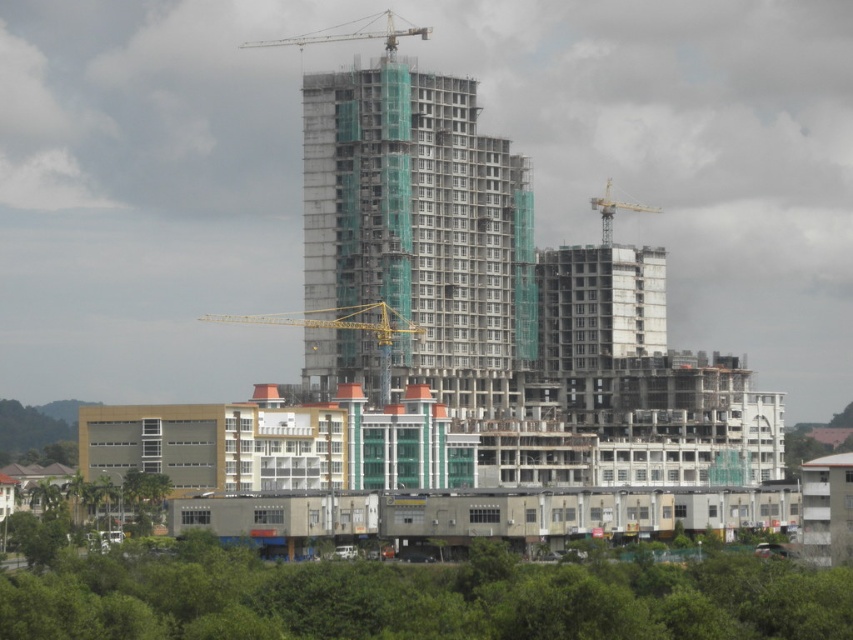
Question: Estimate the real-world distances between objects in this image. Which object is farther from the green leafy trees at lower center?

Choices:
 (A) concrete scaffolding at center
 (B) metallic gray crane at upper center
 (C) yellow metallic crane at center
 (D) yellow metallic crane at upper center

Answer: (D)

Question: Is metallic gray crane at upper center positioned before yellow metallic crane at upper center?

Choices:
 (A) yes
 (B) no

Answer: (A)

Question: Which object appears closest to the camera in this image?

Choices:
 (A) yellow metallic crane at upper center
 (B) concrete scaffolding at center
 (C) yellow metallic crane at center
 (D) green leafy trees at lower center

Answer: (D)

Question: Is green leafy trees at lower center smaller than metallic gray crane at upper center?

Choices:
 (A) no
 (B) yes

Answer: (B)

Question: Does green leafy trees at lower center lie in front of metallic gray crane at upper center?

Choices:
 (A) no
 (B) yes

Answer: (B)

Question: Which point appears closest to the camera in this image?

Choices:
 (A) (387, 49)
 (B) (306, 314)

Answer: (B)